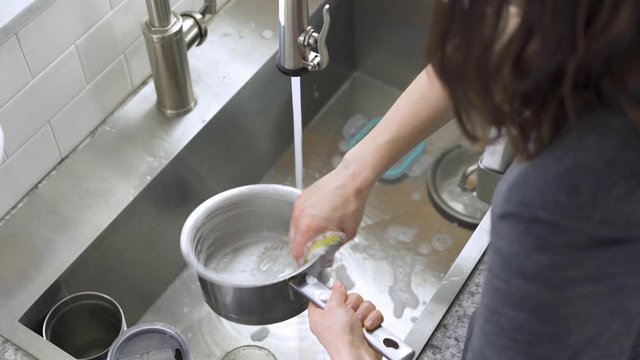
At what (x,y) coordinates should I click in order to perform the action: click on inside of the sink on the bottom near the drain. Please return your answer as a coordinate pair (x, y). The width and height of the screenshot is (640, 360). Looking at the image, I should click on point(250,356).